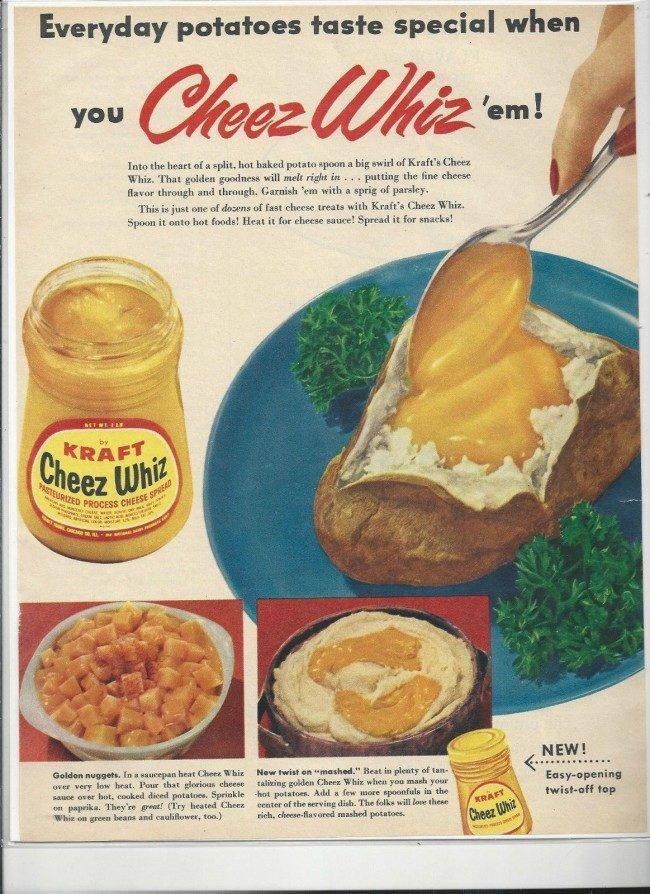
You are a GUI agent. You are given a task and a screenshot of the screen. Output one action in this format:
    pyautogui.click(x=<x>, y=<y>)
    Task: Click on the bottle
    Image resolution: width=650 pixels, height=894 pixels.
    Given the screenshot: What is the action you would take?
    pyautogui.click(x=125, y=370)